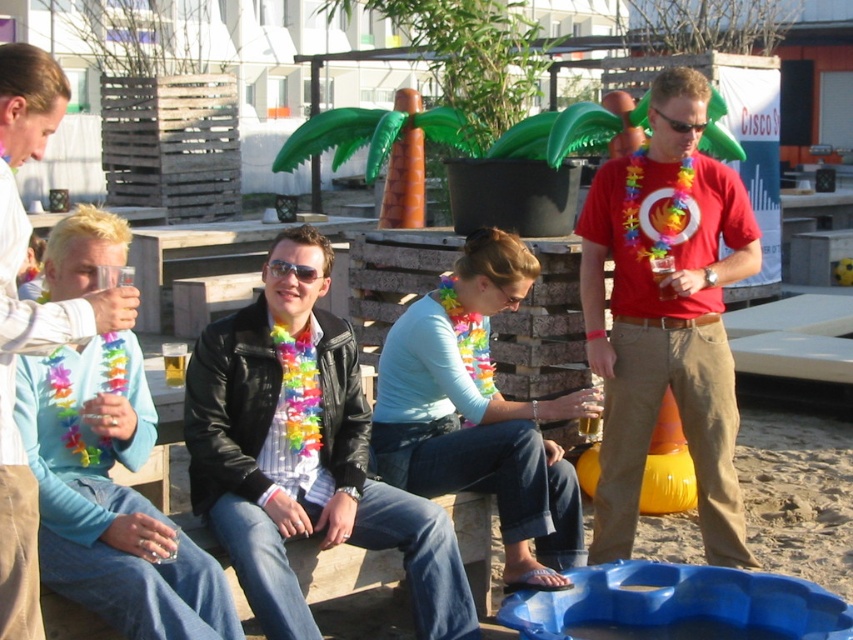
Consider the image. Can you confirm if light blue sweater at left is wider than matte black jacket at left?

Correct, the width of light blue sweater at left exceeds that of matte black jacket at left.

Does light blue sweater at left have a larger size compared to matte black jacket at left?

Yes.

What do you see at coordinates (111, 497) in the screenshot? I see `light blue sweater at left` at bounding box center [111, 497].

Locate an element on the screen. The image size is (853, 640). light blue sweater at left is located at coordinates (111, 497).

Does point (12, 445) lie in front of point (654, 273)?

Yes, point (12, 445) is closer to viewer.

Does matte black jacket at left have a larger size compared to translucent glass beer at center?

Yes, matte black jacket at left is bigger than translucent glass beer at center.

Between point (78, 316) and point (659, 269), which one is positioned behind?

Positioned behind is point (659, 269).

Find the location of a particular element. matte black jacket at left is located at coordinates (32, 321).

Describe the element at coordinates (303, 456) in the screenshot. I see `leather jacket at center` at that location.

Between leather jacket at center and red matte t-shirt at center, which one is positioned lower?

leather jacket at center is lower down.

Is point (309, 419) positioned after point (664, 312)?

No, it is not.

The width and height of the screenshot is (853, 640). In order to click on leather jacket at center in this screenshot , I will do `click(303, 456)`.